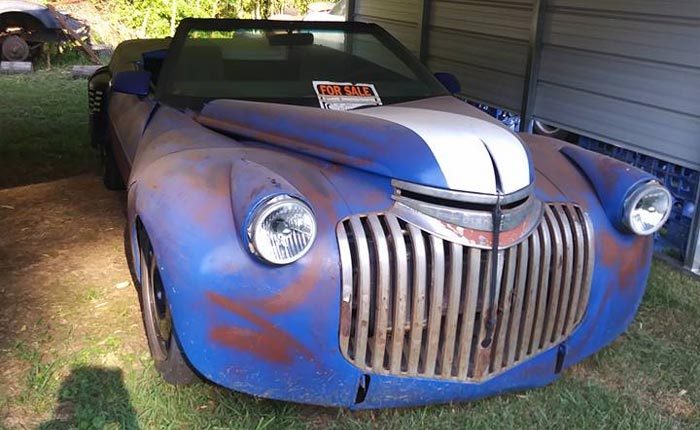
Where is `mirror`? mirror is located at coordinates (288, 39).